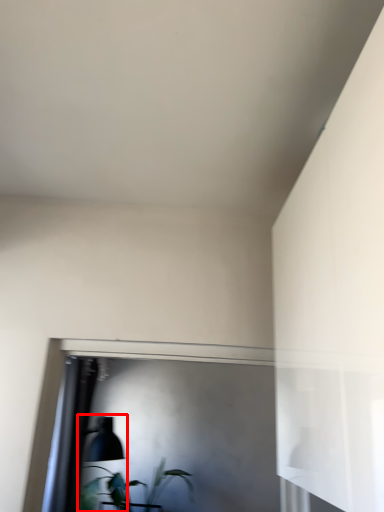
Question: From the image's perspective, what is the correct spatial positioning of table lamp (annotated by the red box) in reference to houseplant?

Choices:
 (A) above
 (B) below

Answer: (A)